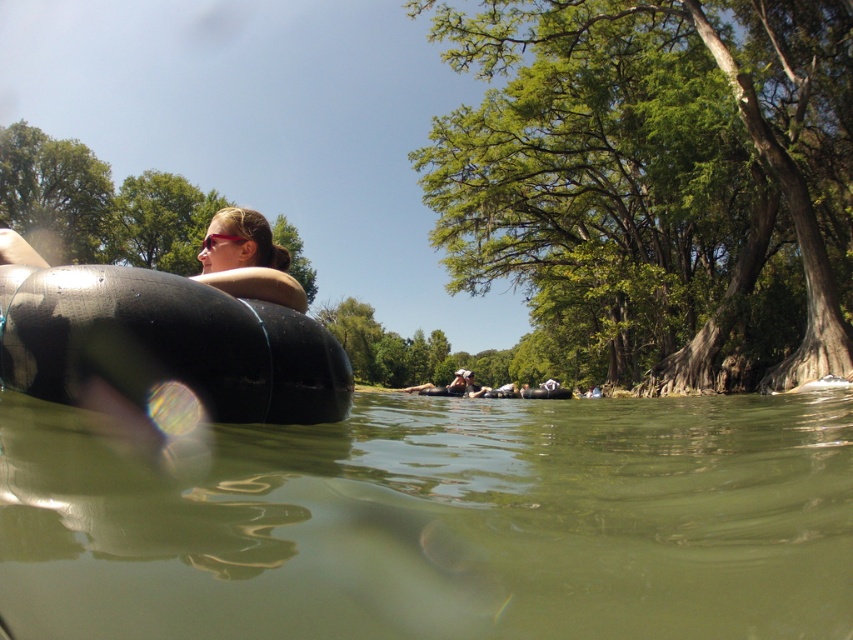
Who is higher up, green murky water at lower center or matte black tube at upper left?

matte black tube at upper left is above.

This screenshot has height=640, width=853. I want to click on green murky water at lower center, so pos(438,522).

What do you see at coordinates (165, 344) in the screenshot? This screenshot has height=640, width=853. I see `black rubber tube at left` at bounding box center [165, 344].

Between point (132, 289) and point (264, 272), which one is positioned in front?

Point (132, 289) is in front.

Identify the location of black rubber tube at left. (165, 344).

Between green murky water at lower center and black rubber tube at left, which one has less height?

Standing shorter between the two is black rubber tube at left.

Can you confirm if green murky water at lower center is wider than black rubber tube at left?

Yes.

Is point (357, 522) in front of point (260, 371)?

Yes, it is.

The height and width of the screenshot is (640, 853). In order to click on green murky water at lower center in this screenshot , I will do pos(438,522).